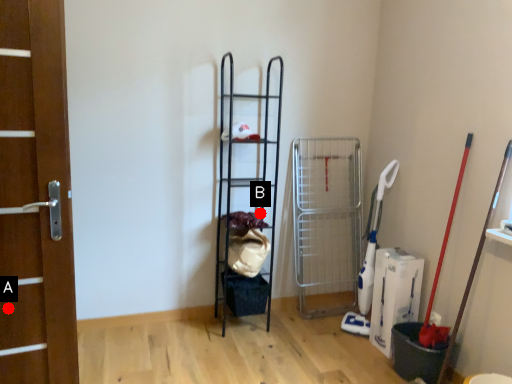
Question: Two points are circled on the image, labeled by A and B beside each circle. Which point is farther from the camera taking this photo?

Choices:
 (A) A is further
 (B) B is further

Answer: (B)